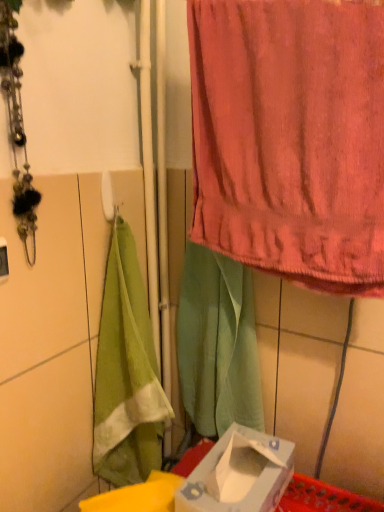
Question: Is green fabric at center located within white cardboard box at lower center?

Choices:
 (A) yes
 (B) no

Answer: (B)

Question: Are white cardboard box at lower center and green fabric at center making contact?

Choices:
 (A) no
 (B) yes

Answer: (A)

Question: Is white cardboard box at lower center completely or partially outside of green fabric at center?

Choices:
 (A) yes
 (B) no

Answer: (A)

Question: Considering the relative sizes of white cardboard box at lower center and green fabric at center in the image provided, is white cardboard box at lower center wider than green fabric at center?

Choices:
 (A) yes
 (B) no

Answer: (A)

Question: From the image's perspective, is white cardboard box at lower center under green fabric at center?

Choices:
 (A) yes
 (B) no

Answer: (A)

Question: Is pink terry cloth towel at upper right inside or outside of white cardboard box at lower center?

Choices:
 (A) inside
 (B) outside

Answer: (B)

Question: From the image's perspective, relative to white cardboard box at lower center, is pink terry cloth towel at upper right above or below?

Choices:
 (A) below
 (B) above

Answer: (B)

Question: In terms of width, does pink terry cloth towel at upper right look wider or thinner when compared to white cardboard box at lower center?

Choices:
 (A) wide
 (B) thin

Answer: (B)

Question: Does point (228, 74) appear closer or farther from the camera than point (236, 477)?

Choices:
 (A) farther
 (B) closer

Answer: (B)

Question: From a real-world perspective, is pink terry cloth towel at upper right positioned above or below green fabric at center?

Choices:
 (A) below
 (B) above

Answer: (B)

Question: From the image's perspective, is pink terry cloth towel at upper right above or below green fabric at center?

Choices:
 (A) above
 (B) below

Answer: (A)

Question: Is pink terry cloth towel at upper right in front of or behind green fabric at center in the image?

Choices:
 (A) front
 (B) behind

Answer: (A)

Question: Does point (339, 273) appear closer or farther from the camera than point (225, 261)?

Choices:
 (A) closer
 (B) farther

Answer: (A)

Question: Considering the positions of green fabric at center and pink terry cloth towel at upper right in the image, is green fabric at center taller or shorter than pink terry cloth towel at upper right?

Choices:
 (A) short
 (B) tall

Answer: (B)

Question: Based on their sizes in the image, would you say green fabric at center is bigger or smaller than pink terry cloth towel at upper right?

Choices:
 (A) big
 (B) small

Answer: (B)